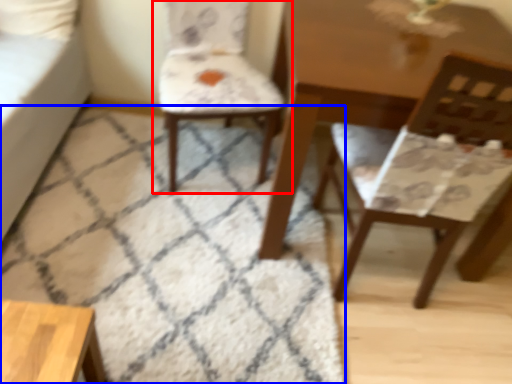
Question: Among these objects, which one is farthest to the camera, chair (highlighted by a red box) or mat (highlighted by a blue box)?

Choices:
 (A) chair
 (B) mat

Answer: (A)